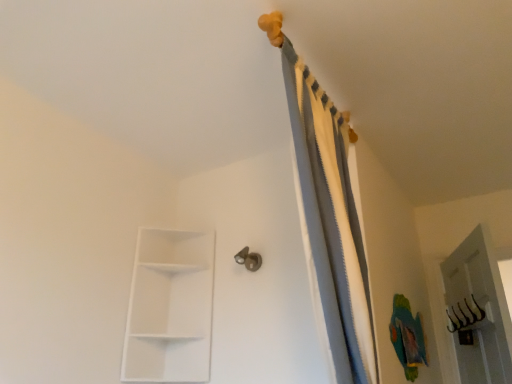
Question: Considering the positions of metallic silver door handle at center and gray fabric curtain at upper center in the image, is metallic silver door handle at center taller or shorter than gray fabric curtain at upper center?

Choices:
 (A) tall
 (B) short

Answer: (B)

Question: In terms of width, does metallic silver door handle at center look wider or thinner when compared to gray fabric curtain at upper center?

Choices:
 (A) wide
 (B) thin

Answer: (B)

Question: Estimate the real-world distances between objects in this image. Which object is closer to the white matte/shelf at lower left?

Choices:
 (A) metallic silver door handle at center
 (B) gray fabric curtain at upper center

Answer: (A)

Question: Which object is positioned closest to the white matte/shelf at lower left?

Choices:
 (A) metallic silver door handle at center
 (B) gray fabric curtain at upper center

Answer: (A)